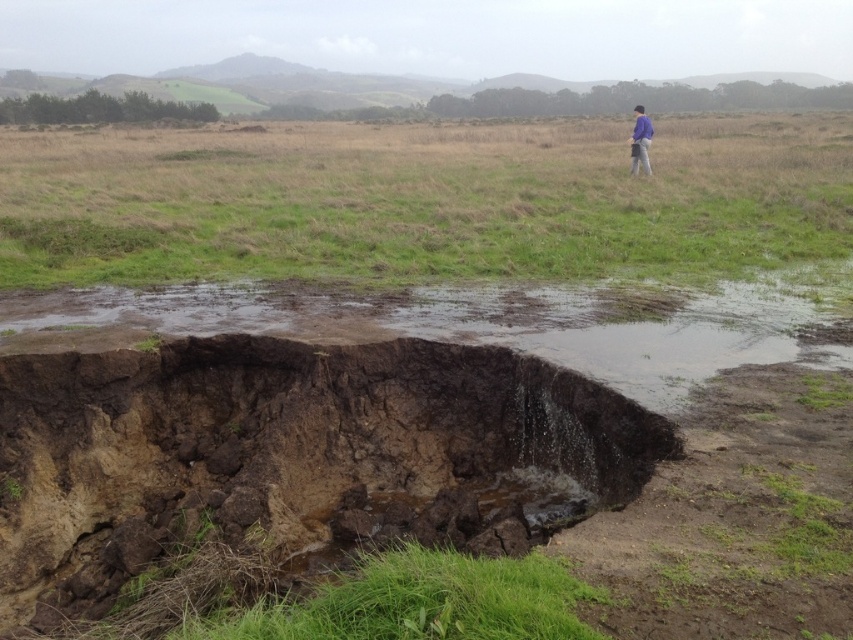
Does green grass at upper center come in front of purple fabric jacket at upper right?

Yes, green grass at upper center is in front of purple fabric jacket at upper right.

Which of these two, green grass at upper center or purple fabric jacket at upper right, stands shorter?

With less height is green grass at upper center.

At what (x,y) coordinates should I click in order to perform the action: click on green grass at upper center. Please return your answer as a coordinate pair (x, y). Looking at the image, I should click on (419, 200).

Does brown muddy water at center come in front of purple fabric jacket at upper right?

That is True.

Is brown muddy water at center below purple fabric jacket at upper right?

Correct, brown muddy water at center is located below purple fabric jacket at upper right.

The image size is (853, 640). Find the location of `brown muddy water at center`. brown muddy water at center is located at coordinates (505, 321).

Between brown muddy hole at center and brown muddy water at center, which one is positioned higher?

Positioned higher is brown muddy water at center.

Is point (595, 429) closer to viewer compared to point (839, 321)?

Yes, point (595, 429) is in front of point (839, 321).

Does point (35, 616) come closer to viewer compared to point (535, 324)?

Yes.

Where is `brown muddy hole at center`? The width and height of the screenshot is (853, 640). brown muddy hole at center is located at coordinates (283, 468).